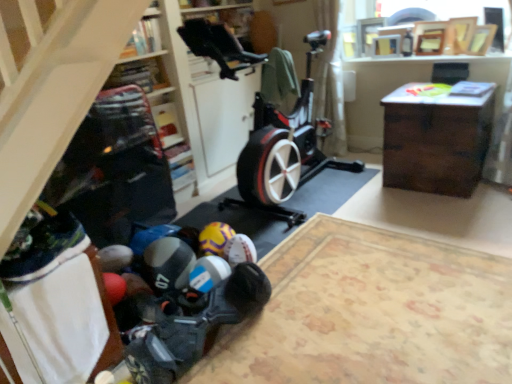
This screenshot has width=512, height=384. Find the location of `rubberized black mat at lower left`. rubberized black mat at lower left is located at coordinates (370, 313).

I want to click on matte plastic shelf at upper center, which ranks as the second shelf in top-to-bottom order, so click(x=167, y=124).

This screenshot has width=512, height=384. What do you see at coordinates (167, 124) in the screenshot? I see `matte plastic shelf at upper center, which ranks as the second shelf in top-to-bottom order` at bounding box center [167, 124].

Image resolution: width=512 pixels, height=384 pixels. What do you see at coordinates (55, 98) in the screenshot? I see `wooden cabinet at center` at bounding box center [55, 98].

In order to face dark wood desk at right, should I rotate leftwards or rightwards?

Rotate right and turn 23.513 degrees.

What is the approximate height of dark wood desk at right?

dark wood desk at right is 24.76 inches tall.

Identify the location of wooden bookshelf at upper center, placed as the second shelf when sorted from back to front. This screenshot has height=384, width=512. (143, 38).

From a real-world perspective, who is located higher, wooden cabinet at center or matte plastic shelf at upper center, marked as the 2th shelf in a front-to-back arrangement?

In real-world perspective, wooden cabinet at center is above.

Looking at this image, from the image's perspective, is wooden cabinet at center above matte plastic shelf at upper center, marked as the 2th shelf in a front-to-back arrangement?

No, from the image's perspective, wooden cabinet at center is not over matte plastic shelf at upper center, marked as the 2th shelf in a front-to-back arrangement.

Is wooden cabinet at center shorter than matte plastic shelf at upper center, arranged as the first shelf when ordered from the bottom?

No, wooden cabinet at center is not shorter than matte plastic shelf at upper center, arranged as the first shelf when ordered from the bottom.

Considering the positions of point (39, 167) and point (159, 105), is point (39, 167) closer or farther from the camera than point (159, 105)?

Point (39, 167) is positioned closer to the camera compared to point (159, 105).

Considering the sizes of objects rubberized black mat at lower left and wooden cabinet at center in the image provided, who is smaller, rubberized black mat at lower left or wooden cabinet at center?

Smaller between the two is rubberized black mat at lower left.

Is rubberized black mat at lower left looking in the opposite direction of wooden cabinet at center?

No, wooden cabinet at center is not at the back of rubberized black mat at lower left.

Which is behind, rubberized black mat at lower left or wooden cabinet at center?

wooden cabinet at center is further away from the camera.

Is rubberized black mat at lower left aimed at yellow matte soccer ball at lower center, the 1th toy when ordered from back to front?

No, rubberized black mat at lower left is not turned towards yellow matte soccer ball at lower center, the 1th toy when ordered from back to front.

Is the surface of rubberized black mat at lower left in direct contact with yellow matte soccer ball at lower center, the 1th toy when ordered from back to front?

No, rubberized black mat at lower left is not touching yellow matte soccer ball at lower center, the 1th toy when ordered from back to front.

Between rubberized black mat at lower left and yellow matte soccer ball at lower center, which is counted as the 2th toy, starting from the front, which one has larger size?

rubberized black mat at lower left is bigger.

Is dark wood desk at right oriented towards white sheer curtain at upper center?

No.

Is dark wood desk at right positioned behind white sheer curtain at upper center?

No.

Looking at this image, from the image's perspective, relative to white sheer curtain at upper center, is dark wood desk at right above or below?

From the image's perspective, dark wood desk at right appears below white sheer curtain at upper center.

In terms of height, does dark wood desk at right look taller or shorter compared to white sheer curtain at upper center?

Clearly, dark wood desk at right is shorter compared to white sheer curtain at upper center.

Is matte plastic shelf at upper center, arranged as the first shelf when ordered from the bottom, far from wooden bookshelf at upper center, the 1th shelf from the top?

No.

Considering the positions of objects matte plastic shelf at upper center, which ranks as the second shelf in top-to-bottom order, and wooden bookshelf at upper center, placed as the second shelf when sorted from back to front, in the image provided, who is more to the left, matte plastic shelf at upper center, which ranks as the second shelf in top-to-bottom order, or wooden bookshelf at upper center, placed as the second shelf when sorted from back to front,?

wooden bookshelf at upper center, placed as the second shelf when sorted from back to front.

Considering the relative sizes of matte plastic shelf at upper center, arranged as the first shelf when ordered from the bottom, and wooden bookshelf at upper center, acting as the second shelf starting from the bottom, in the image provided, is matte plastic shelf at upper center, arranged as the first shelf when ordered from the bottom, shorter than wooden bookshelf at upper center, acting as the second shelf starting from the bottom,?

In fact, matte plastic shelf at upper center, arranged as the first shelf when ordered from the bottom, may be taller than wooden bookshelf at upper center, acting as the second shelf starting from the bottom.

Can you confirm if rubberized black mat at lower left is bigger than wooden bookshelf at upper center, the 1th shelf in the front-to-back sequence?

Indeed, rubberized black mat at lower left has a larger size compared to wooden bookshelf at upper center, the 1th shelf in the front-to-back sequence.

Looking at this image, considering the positions of objects rubberized black mat at lower left and wooden bookshelf at upper center, placed as the second shelf when sorted from back to front, in the image provided, who is behind, rubberized black mat at lower left or wooden bookshelf at upper center, placed as the second shelf when sorted from back to front,?

wooden bookshelf at upper center, placed as the second shelf when sorted from back to front.

Would you say rubberized black mat at lower left is a long distance from wooden bookshelf at upper center, acting as the second shelf starting from the bottom?

Indeed, rubberized black mat at lower left is not near wooden bookshelf at upper center, acting as the second shelf starting from the bottom.

Is wooden cabinet at center in contact with rubberized plastic toy at lower center, marked as the second toy in a back-to-front arrangement?

No, wooden cabinet at center is not next to rubberized plastic toy at lower center, marked as the second toy in a back-to-front arrangement.

How different are the orientations of wooden cabinet at center and rubberized plastic toy at lower center, marked as the second toy in a back-to-front arrangement, in degrees?

174 degrees separate the facing orientations of wooden cabinet at center and rubberized plastic toy at lower center, marked as the second toy in a back-to-front arrangement.

Is point (63, 37) closer or farther from the camera than point (103, 274)?

Point (63, 37) is closer to the camera than point (103, 274).

Looking at the image, does wooden cabinet at center seem bigger or smaller compared to rubberized plastic toy at lower center, marked as the second toy in a back-to-front arrangement?

Clearly, wooden cabinet at center is larger in size than rubberized plastic toy at lower center, marked as the second toy in a back-to-front arrangement.

From the wooden cabinet at center, count 2nd shelfs backward and point to it. Please provide its 2D coordinates.

[(167, 124)]

Where is `mat in front of the wooden cabinet at center`? mat in front of the wooden cabinet at center is located at coordinates (370, 313).

Based on the photo, considering their positions, is wooden cabinet at center positioned closer to yellow matte soccer ball at lower center, which is counted as the 2th toy, starting from the front, than wooden bookshelf at upper center, the 1th shelf in the front-to-back sequence?

Among the two, wooden cabinet at center is located nearer to yellow matte soccer ball at lower center, which is counted as the 2th toy, starting from the front.

Which object lies nearer to the anchor point matte plastic shelf at upper center, which ranks as the second shelf in top-to-bottom order, white sheer curtain at upper center or wooden cabinet at center?

white sheer curtain at upper center is positioned closer to the anchor matte plastic shelf at upper center, which ranks as the second shelf in top-to-bottom order.

From the image, which object appears to be farther from dark wood desk at right, matte plastic shelf at upper center, marked as the 2th shelf in a front-to-back arrangement, or rubberized black mat at lower left?

matte plastic shelf at upper center, marked as the 2th shelf in a front-to-back arrangement.

Which object lies nearer to the anchor point yellow matte soccer ball at lower center, which is counted as the 2th toy, starting from the front, rubberized black mat at lower left or matte plastic shelf at upper center, arranged as the first shelf when ordered from the bottom?

rubberized black mat at lower left is closer to yellow matte soccer ball at lower center, which is counted as the 2th toy, starting from the front.

Looking at the image, which one is located further to dark wood desk at right, rubberized black mat at lower left or white sheer curtain at upper center?

Among the two, white sheer curtain at upper center is located further to dark wood desk at right.

Estimate the real-world distances between objects in this image. Which object is closer to white sheer curtain at upper center, dark wood desk at right or wooden cabinet at center?

dark wood desk at right is closer to white sheer curtain at upper center.

Estimate the real-world distances between objects in this image. Which object is further from rubberized plastic toy at lower center, marked as the second toy in a back-to-front arrangement, wooden bookshelf at upper center, the 1th shelf from the top, or yellow matte soccer ball at lower center, which is counted as the 2th toy, starting from the front?

The object further to rubberized plastic toy at lower center, marked as the second toy in a back-to-front arrangement, is wooden bookshelf at upper center, the 1th shelf from the top.

Consider the image. Based on their spatial positions, is yellow matte soccer ball at lower center, which is counted as the 2th toy, starting from the front, or white sheer curtain at upper center further from wooden cabinet at center?

white sheer curtain at upper center lies further to wooden cabinet at center than the other object.

The width and height of the screenshot is (512, 384). What are the coordinates of `cabinetry located between rubberized black mat at lower left and white sheer curtain at upper center in the depth direction` in the screenshot? It's located at (55, 98).

Locate an element on the screen. desk located between rubberized black mat at lower left and white sheer curtain at upper center in the depth direction is located at coordinates (435, 140).

Identify the location of desk between rubberized black mat at lower left and matte plastic shelf at upper center, arranged as the first shelf when ordered from the bottom, along the z-axis. (435, 140).

You are a GUI agent. You are given a task and a screenshot of the screen. Output one action in this format:
    pyautogui.click(x=<x>, y=<y>)
    Task: Click on the shelf between wooden bookshelf at upper center, the 1th shelf in the front-to-back sequence, and white sheer curtain at upper center from left to right
    The height and width of the screenshot is (384, 512).
    Given the screenshot: What is the action you would take?
    pyautogui.click(x=167, y=124)